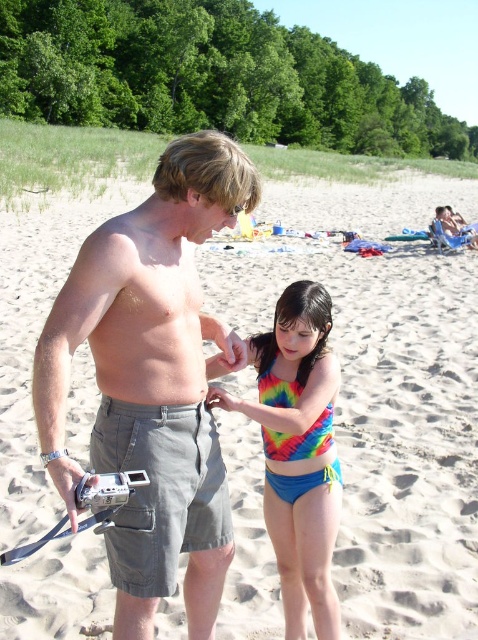
Question: Can you confirm if gray cotton shorts at center is smaller than rainbow tie-dye bikini bottom at center?

Choices:
 (A) no
 (B) yes

Answer: (A)

Question: Based on their relative distances, which object is farther from the tie-dye fabric bikini at center?

Choices:
 (A) rainbow tie-dye bikini bottom at center
 (B) gray cotton shorts at center
 (C) sandy beach at center

Answer: (C)

Question: Which point is farther to the camera?

Choices:
 (A) (90, 422)
 (B) (258, 353)
 (C) (220, 168)
 (D) (304, 490)

Answer: (A)

Question: Which point is closer to the camera taking this photo?

Choices:
 (A) (156, 488)
 (B) (329, 388)

Answer: (A)

Question: Does sandy beach at center appear over rainbow tie-dye bikini bottom at center?

Choices:
 (A) no
 (B) yes

Answer: (B)

Question: From the image, what is the correct spatial relationship of gray cotton shorts at center in relation to gray cotton shorts at lower center?

Choices:
 (A) right
 (B) left

Answer: (B)